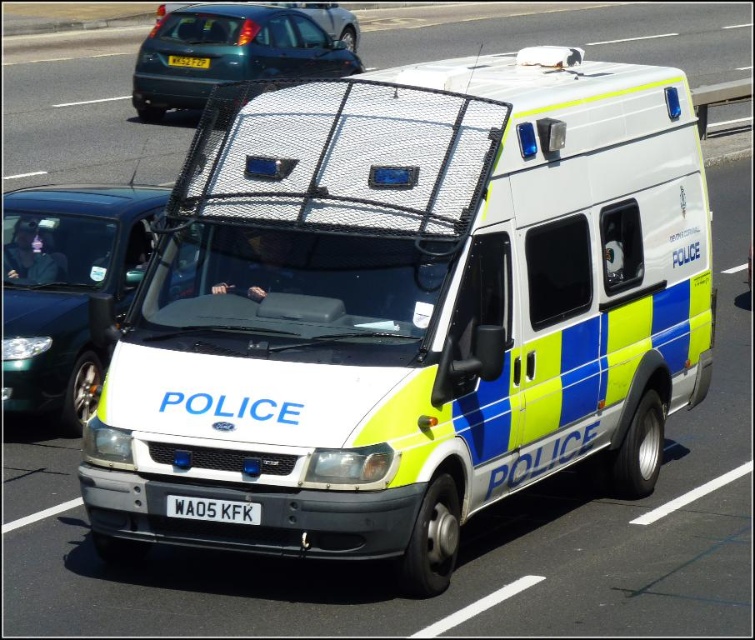
Can you confirm if metallic blue hatchback at upper left is bigger than yellow matte license plate at center?

Yes.

Who is higher up, metallic blue hatchback at upper left or yellow matte license plate at center?

metallic blue hatchback at upper left is above.

At what (x,y) coordinates should I click in order to perform the action: click on metallic blue hatchback at upper left. Please return your answer as a coordinate pair (x, y). Looking at the image, I should click on (233, 51).

Locate an element on the screen. The width and height of the screenshot is (755, 640). metallic blue hatchback at upper left is located at coordinates (x=233, y=51).

Can you confirm if metallic blue car at upper left is positioned below white plastic license plate at center?

Actually, metallic blue car at upper left is above white plastic license plate at center.

Which is in front, point (328, 8) or point (257, 513)?

Point (257, 513) is in front.

Between point (316, 22) and point (216, 512), which one is positioned in front?

Point (216, 512) is in front.

Locate an element on the screen. metallic blue car at upper left is located at coordinates (x=300, y=10).

How distant is white glossy van at center from metallic blue hatchback at upper left?

white glossy van at center and metallic blue hatchback at upper left are 47.83 feet apart from each other.

Does white glossy van at center have a larger size compared to metallic blue hatchback at upper left?

Correct, white glossy van at center is larger in size than metallic blue hatchback at upper left.

Which is behind, point (479, 56) or point (177, 20)?

Point (479, 56)

Find the location of a particular element. Image resolution: width=755 pixels, height=640 pixels. white glossy van at center is located at coordinates (408, 308).